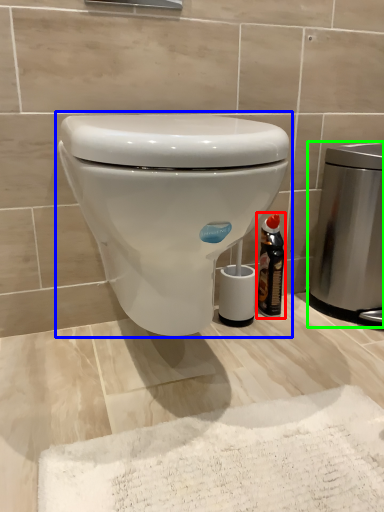
Question: Which object is the closest to the bottle (highlighted by a red box)? Choose among these: toilet (highlighted by a blue box) or appliance (highlighted by a green box).

Choices:
 (A) toilet
 (B) appliance

Answer: (B)